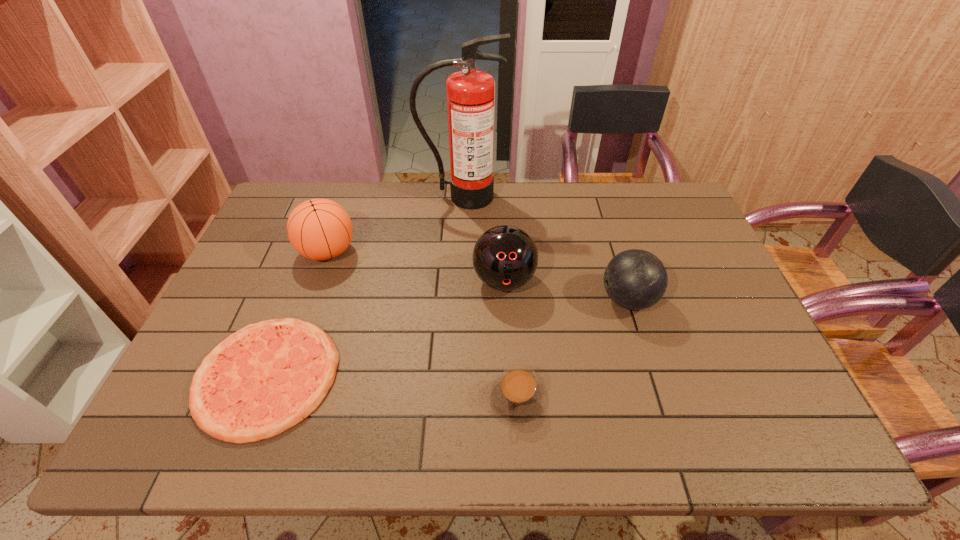
The height and width of the screenshot is (540, 960). In order to click on vacant space located on the grip area of the rightmost object in this screenshot , I will do `click(518, 300)`.

At what (x,y) coordinates should I click in order to perform the action: click on free space located on the grip area of the rightmost object. Please return your answer as a coordinate pair (x, y). The width and height of the screenshot is (960, 540). Looking at the image, I should click on (533, 300).

Identify the location of vacant space located on the grip area of the rightmost object. This screenshot has width=960, height=540. click(x=525, y=300).

You are a GUI agent. You are given a task and a screenshot of the screen. Output one action in this format:
    pyautogui.click(x=<x>, y=<y>)
    Task: Click on the free space located on the back of the fifth tallest object
    
    Given the screenshot: What is the action you would take?
    pyautogui.click(x=511, y=296)

I want to click on vacant position located on the right of the shortest object, so click(481, 376).

Image resolution: width=960 pixels, height=540 pixels. What are the coordinates of `object situated at the far edge` in the screenshot? It's located at (470, 93).

You are a GUI agent. You are given a task and a screenshot of the screen. Output one action in this format:
    pyautogui.click(x=<x>, y=<y>)
    Task: Click on the cappuccino located at the near edge
    Image resolution: width=960 pixels, height=540 pixels.
    Given the screenshot: What is the action you would take?
    pyautogui.click(x=517, y=395)

You are a GUI agent. You are given a task and a screenshot of the screen. Output one action in this format:
    pyautogui.click(x=<x>, y=<y>)
    Task: Click on the pizza that is at the near edge
    
    Given the screenshot: What is the action you would take?
    pyautogui.click(x=262, y=380)

What are the coordinates of `basketball that is at the left edge` in the screenshot? It's located at (319, 229).

Locate an element on the screen. Image resolution: width=960 pixels, height=540 pixels. pizza that is at the left edge is located at coordinates (262, 380).